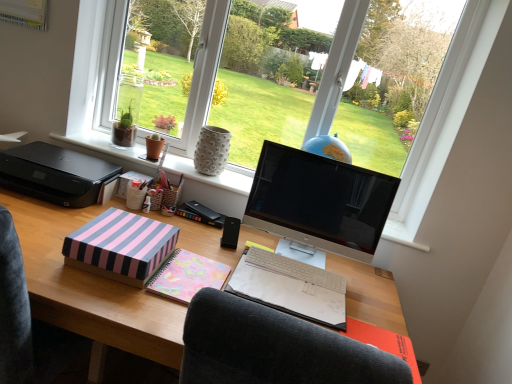
I want to click on vacant area located to the right-hand side of white plastic keyboard at center, so click(x=362, y=283).